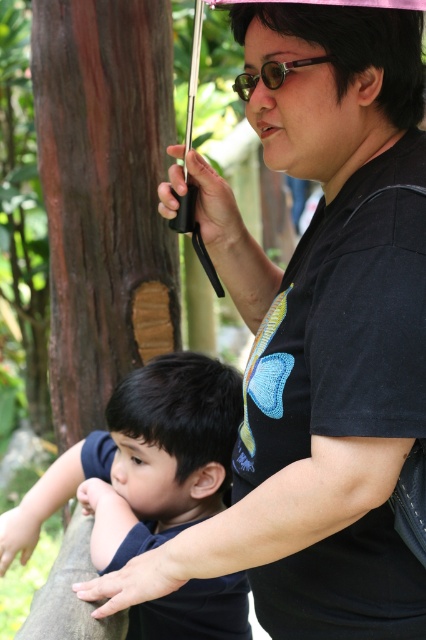
You are a photographer trying to capture the scene where the woman and child are standing. You notice the pink matte umbrella at upper center and the gold reflective lenses at center. Which object should you focus on first if you want to ensure both are in the frame without moving the camera?

The pink matte umbrella at upper center is located below the gold reflective lenses at center, so you should focus on the gold reflective lenses at center first to ensure both objects remain in the frame without moving the camera.

You are a photographer trying to capture a clear shot of both the pink matte umbrella at upper center and the gold reflective lenses at center. Which object should you focus on first to ensure both are in focus?

You should focus on the pink matte umbrella at upper center first because it is closer to the viewer than the gold reflective lenses at center, so adjusting focus from near to far will help both objects be in focus.